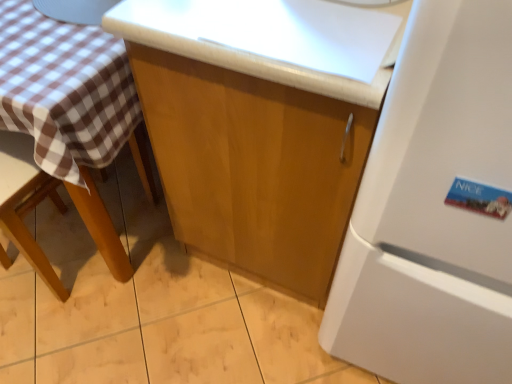
Locate an element on the screen. Image resolution: width=512 pixels, height=384 pixels. free space in front of glossy wood cabinet at center is located at coordinates (228, 340).